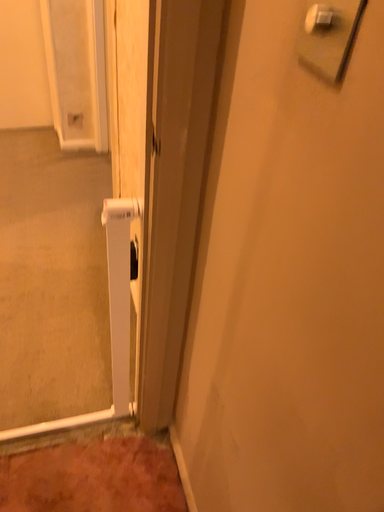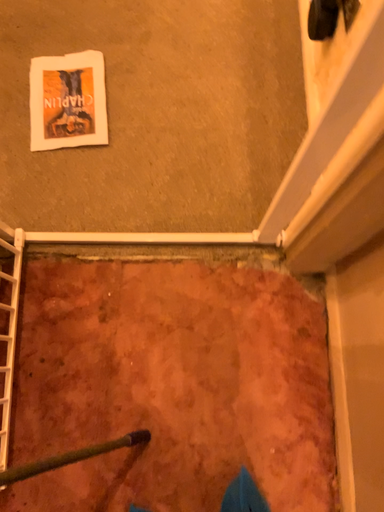
Question: Which way did the camera rotate in the video?

Choices:
 (A) rotated right
 (B) rotated left

Answer: (B)